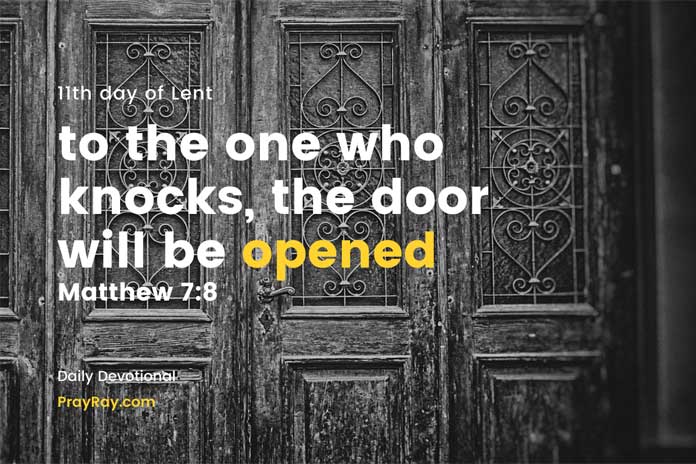
Where is `handle`? This screenshot has height=464, width=696. handle is located at coordinates (267, 293).